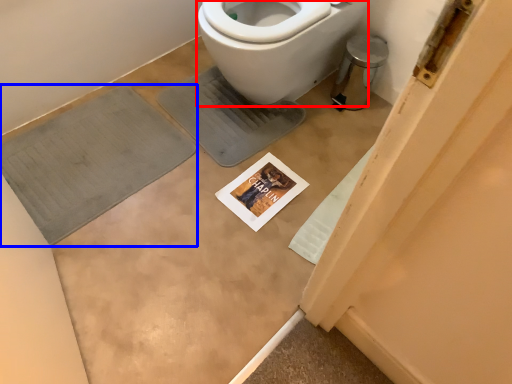
Question: Among these objects, which one is nearest to the camera, bidet (highlighted by a red box) or bath mat (highlighted by a blue box)?

Choices:
 (A) bidet
 (B) bath mat

Answer: (A)